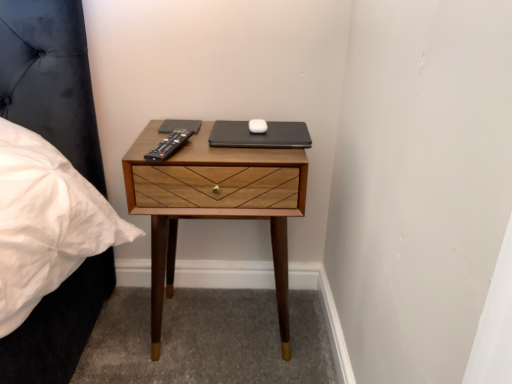
Identify the location of unoccupied area in front of black matte laptop at center. point(254,147).